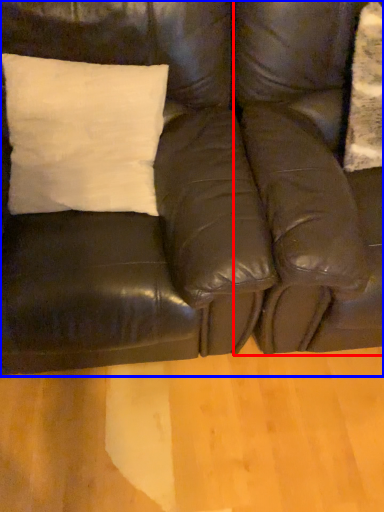
Question: Which of the following is the farthest to the observer, swivel chair (highlighted by a red box) or studio couch (highlighted by a blue box)?

Choices:
 (A) swivel chair
 (B) studio couch

Answer: (A)